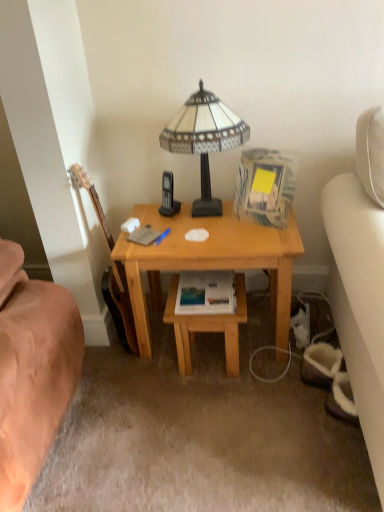
The height and width of the screenshot is (512, 384). I want to click on free spot to the right of wooden acoustic guitar at left, so click(161, 344).